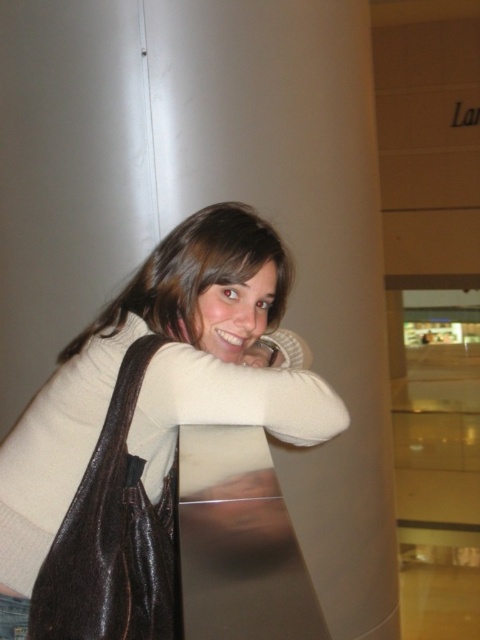
Which of these two, matte beige sweater at center or denim at left, stands taller?

matte beige sweater at center is taller.

Which is behind, point (233, 232) or point (19, 637)?

The point (233, 232) is more distant.

The width and height of the screenshot is (480, 640). In order to click on matte beige sweater at center in this screenshot , I will do `click(195, 275)`.

Between matte brown purse at center and denim at left, which one appears on the left side from the viewer's perspective?

From the viewer's perspective, denim at left appears more on the left side.

Can you confirm if matte brown purse at center is taller than denim at left?

Yes, matte brown purse at center is taller than denim at left.

I want to click on matte brown purse at center, so click(x=148, y=426).

You are a GUI agent. You are given a task and a screenshot of the screen. Output one action in this format:
    pyautogui.click(x=<x>, y=<y>)
    Task: Click on the matte brown purse at center
    
    Given the screenshot: What is the action you would take?
    pyautogui.click(x=148, y=426)

Which is above, matte brown purse at center or matte beige sweater at center?

matte beige sweater at center is above.

Does point (139, 608) lie in front of point (212, 275)?

Yes, point (139, 608) is in front of point (212, 275).

Find the location of `matte brown purse at center`. matte brown purse at center is located at coordinates (148, 426).